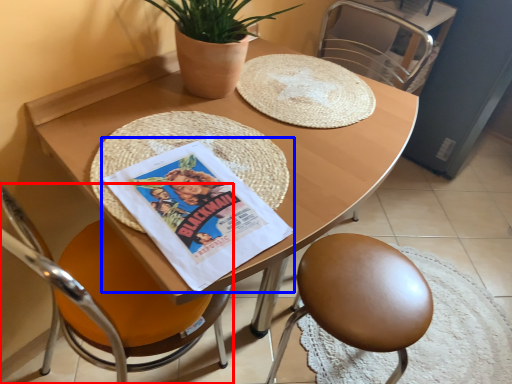
Question: Which point is further to the camera, chair (highlighted by a red box) or comic book (highlighted by a blue box)?

Choices:
 (A) chair
 (B) comic book

Answer: (B)